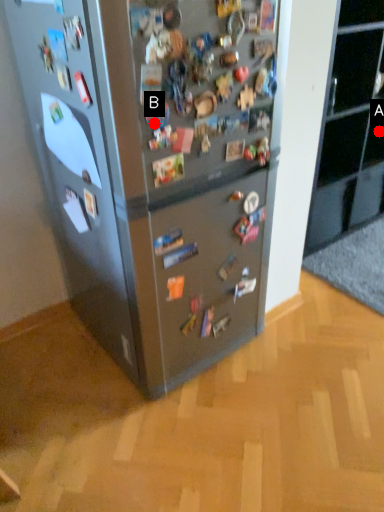
Question: Two points are circled on the image, labeled by A and B beside each circle. Which point is closer to the camera?

Choices:
 (A) A is closer
 (B) B is closer

Answer: (B)